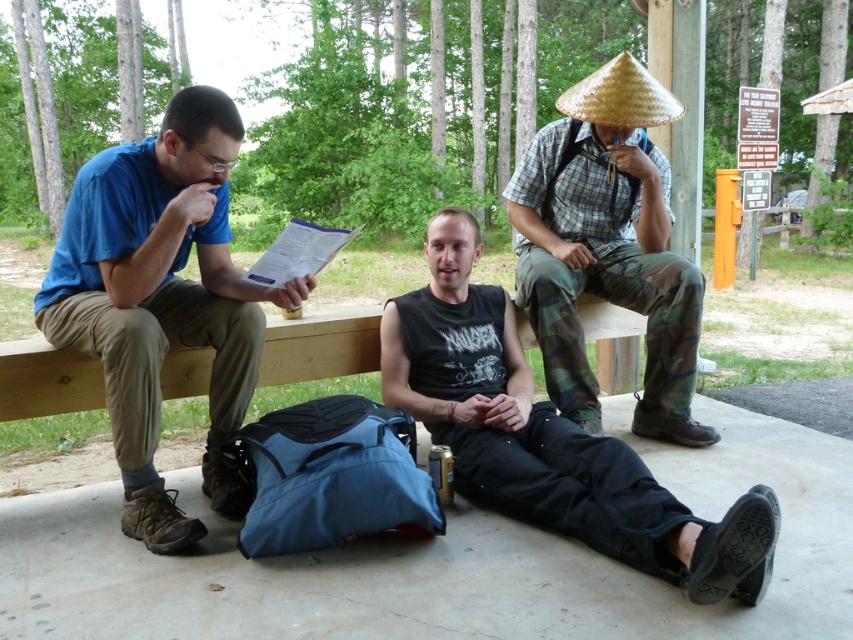
You are a photographer trying to capture a closeup shot of the matte blue shirt at left and the black matte tank top at center. Which one is closer to the camera?

The matte blue shirt at left is positioned over the black matte tank top at center, so the matte blue shirt at left is closer to the camera.

What is the color of the clothing item located at the coordinates point [547,435]?

The clothing item at point [547,435] is a black matte tank top.